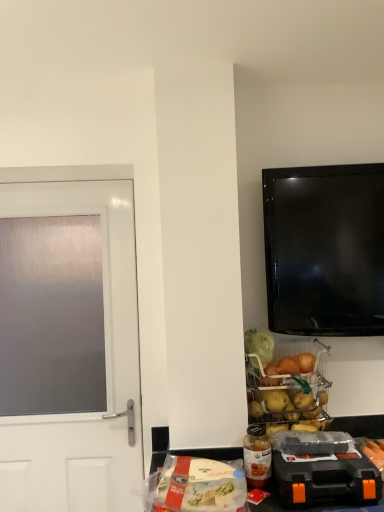
Question: From a real-world perspective, is translucent plastic bottle at lower center beneath satin white door at left?

Choices:
 (A) yes
 (B) no

Answer: (A)

Question: Is translucent plastic bottle at lower center positioned with its back to satin white door at left?

Choices:
 (A) yes
 (B) no

Answer: (B)

Question: Is translucent plastic bottle at lower center oriented towards satin white door at left?

Choices:
 (A) yes
 (B) no

Answer: (B)

Question: Is translucent plastic bottle at lower center shorter than satin white door at left?

Choices:
 (A) no
 (B) yes

Answer: (B)

Question: Can you confirm if translucent plastic bottle at lower center is bigger than satin white door at left?

Choices:
 (A) no
 (B) yes

Answer: (A)

Question: Is metallic wire basket at lower center, the 2th appliance when ordered from front to back, to the left or to the right of translucent plastic bag of pasta at lower center in the image?

Choices:
 (A) left
 (B) right

Answer: (B)

Question: From the image's perspective, relative to translucent plastic bag of pasta at lower center, is metallic wire basket at lower center, the first appliance viewed from the back, above or below?

Choices:
 (A) below
 (B) above

Answer: (B)

Question: Is metallic wire basket at lower center, the first appliance viewed from the back, wider or thinner than translucent plastic bag of pasta at lower center?

Choices:
 (A) wide
 (B) thin

Answer: (B)

Question: Is metallic wire basket at lower center, which appears as the second appliance when ordered from the bottom, taller or shorter than translucent plastic bag of pasta at lower center?

Choices:
 (A) tall
 (B) short

Answer: (A)

Question: From the image's perspective, is translucent plastic bottle at lower center located above or below translucent plastic bag of pasta at lower center?

Choices:
 (A) below
 (B) above

Answer: (B)

Question: Considering their positions, is translucent plastic bottle at lower center located in front of or behind translucent plastic bag of pasta at lower center?

Choices:
 (A) front
 (B) behind

Answer: (B)

Question: From a real-world perspective, is translucent plastic bottle at lower center above or below translucent plastic bag of pasta at lower center?

Choices:
 (A) above
 (B) below

Answer: (A)

Question: Looking at their shapes, would you say translucent plastic bottle at lower center is wider or thinner than translucent plastic bag of pasta at lower center?

Choices:
 (A) wide
 (B) thin

Answer: (B)

Question: Do you think translucent plastic bottle at lower center is within orange plastic toolbox at lower right, which appears as the first appliance when viewed from the front, or outside of it?

Choices:
 (A) outside
 (B) inside

Answer: (A)

Question: In terms of height, does translucent plastic bottle at lower center look taller or shorter compared to orange plastic toolbox at lower right, which appears as the first appliance when viewed from the front?

Choices:
 (A) tall
 (B) short

Answer: (A)